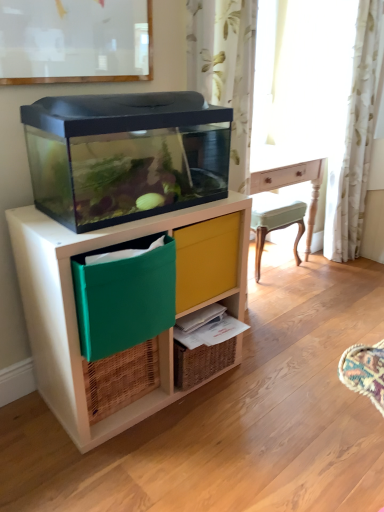
Question: Is woven wood shelf at lower center surrounded by yellow fabric drawer at center?

Choices:
 (A) no
 (B) yes

Answer: (A)

Question: Would you say yellow fabric drawer at center is a long distance from woven wood shelf at lower center?

Choices:
 (A) no
 (B) yes

Answer: (A)

Question: Does yellow fabric drawer at center have a larger size compared to woven wood shelf at lower center?

Choices:
 (A) no
 (B) yes

Answer: (A)

Question: From the image's perspective, is yellow fabric drawer at center located beneath woven wood shelf at lower center?

Choices:
 (A) no
 (B) yes

Answer: (A)

Question: Can you confirm if yellow fabric drawer at center is positioned to the right of woven wood shelf at lower center?

Choices:
 (A) no
 (B) yes

Answer: (B)

Question: Choose the correct answer: Is green fabric storage box at lower left inside woven brown basket at lower left or outside it?

Choices:
 (A) outside
 (B) inside

Answer: (A)

Question: Considering the positions of green fabric storage box at lower left and woven brown basket at lower left in the image, is green fabric storage box at lower left wider or thinner than woven brown basket at lower left?

Choices:
 (A) thin
 (B) wide

Answer: (B)

Question: From the image's perspective, is green fabric storage box at lower left above or below woven brown basket at lower left?

Choices:
 (A) above
 (B) below

Answer: (A)

Question: From a real-world perspective, is green fabric storage box at lower left positioned above or below woven brown basket at lower left?

Choices:
 (A) below
 (B) above

Answer: (B)

Question: Based on their positions, is transparent plastic aquarium at left located to the left or right of white floral fabric curtain at right?

Choices:
 (A) left
 (B) right

Answer: (A)

Question: Considering their positions, is transparent plastic aquarium at left located in front of or behind white floral fabric curtain at right?

Choices:
 (A) behind
 (B) front

Answer: (B)

Question: From a real-world perspective, is transparent plastic aquarium at left positioned above or below white floral fabric curtain at right?

Choices:
 (A) below
 (B) above

Answer: (A)

Question: Is transparent plastic aquarium at left taller or shorter than white floral fabric curtain at right?

Choices:
 (A) short
 (B) tall

Answer: (A)

Question: Is woven brown basket at lower left taller or shorter than yellow fabric drawer at center?

Choices:
 (A) tall
 (B) short

Answer: (B)

Question: From a real-world perspective, relative to yellow fabric drawer at center, is woven brown basket at lower left vertically above or below?

Choices:
 (A) above
 (B) below

Answer: (B)